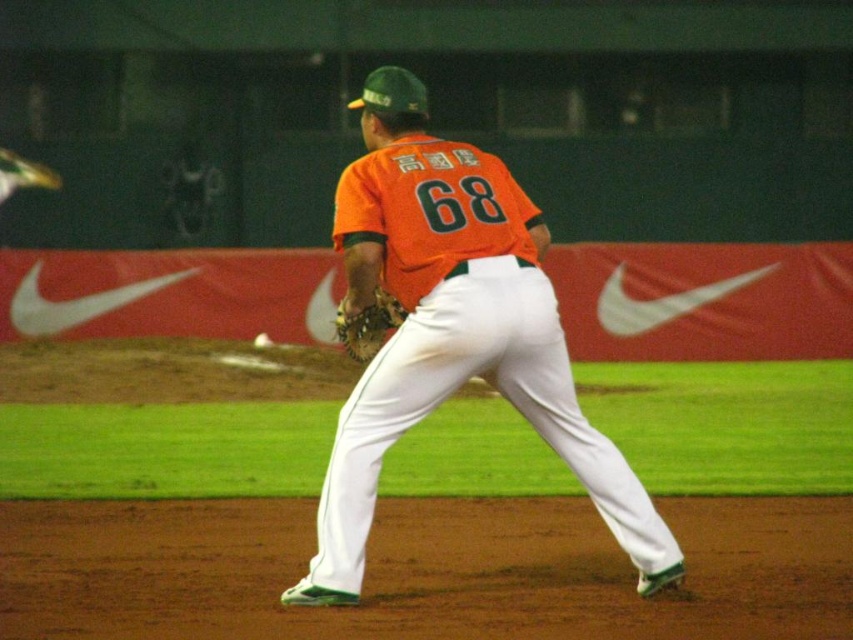
Question: Which object is closer to the camera taking this photo?

Choices:
 (A) leather textured glove at center
 (B) orange matte jersey at center

Answer: (B)

Question: Does orange matte jersey at center have a smaller size compared to leather textured glove at center?

Choices:
 (A) no
 (B) yes

Answer: (A)

Question: Is orange matte jersey at center wider than leather textured glove at center?

Choices:
 (A) no
 (B) yes

Answer: (B)

Question: Which object is farther from the camera taking this photo?

Choices:
 (A) leather textured glove at center
 (B) orange matte jersey at center

Answer: (A)

Question: Is orange matte jersey at center closer to the viewer compared to leather textured glove at center?

Choices:
 (A) no
 (B) yes

Answer: (B)